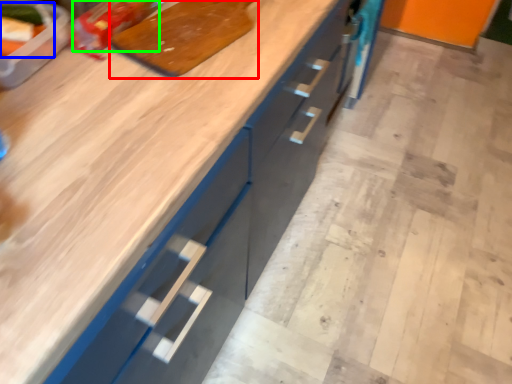
Question: Estimate the real-world distances between objects in this image. Which object is closer to cutting board (highlighted by a red box), food (highlighted by a blue box) or food (highlighted by a green box)?

Choices:
 (A) food
 (B) food

Answer: (B)